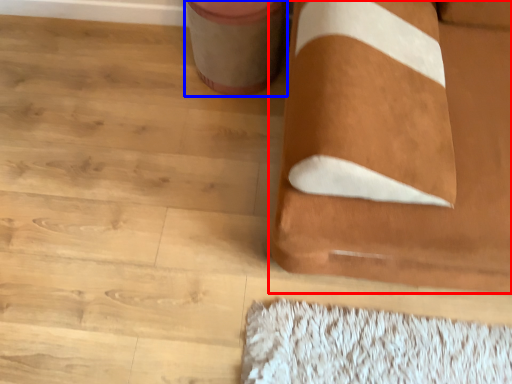
Question: Which object is closer to the camera taking this photo, furniture (highlighted by a red box) or potty (highlighted by a blue box)?

Choices:
 (A) furniture
 (B) potty

Answer: (A)